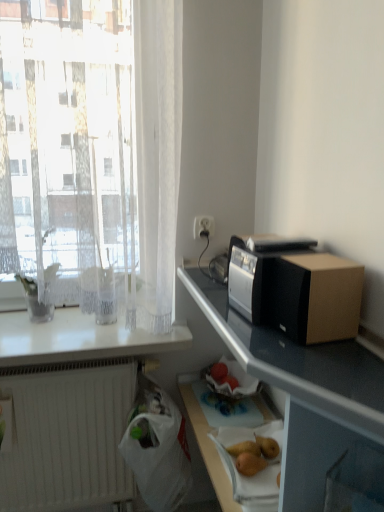
Question: Is black plastic microwave at right bigger than black matte microwave at upper right?

Choices:
 (A) yes
 (B) no

Answer: (B)

Question: Is black plastic microwave at right not inside black matte microwave at upper right?

Choices:
 (A) yes
 (B) no

Answer: (A)

Question: Is black plastic microwave at right turned away from black matte microwave at upper right?

Choices:
 (A) no
 (B) yes

Answer: (A)

Question: Is black plastic microwave at right taller than black matte microwave at upper right?

Choices:
 (A) yes
 (B) no

Answer: (B)

Question: Is black plastic microwave at right at the left side of black matte microwave at upper right?

Choices:
 (A) no
 (B) yes

Answer: (A)

Question: Does black plastic microwave at right have a lesser width compared to black matte microwave at upper right?

Choices:
 (A) yes
 (B) no

Answer: (A)

Question: Is white matte radiator at lower left facing away from white plastic bag at lower center?

Choices:
 (A) no
 (B) yes

Answer: (A)

Question: From the image's perspective, is white matte radiator at lower left above white plastic bag at lower center?

Choices:
 (A) yes
 (B) no

Answer: (B)

Question: Are white matte radiator at lower left and white plastic bag at lower center far apart?

Choices:
 (A) no
 (B) yes

Answer: (A)

Question: Is white matte radiator at lower left at the left side of white plastic bag at lower center?

Choices:
 (A) no
 (B) yes

Answer: (B)

Question: Is white matte radiator at lower left aimed at white plastic bag at lower center?

Choices:
 (A) yes
 (B) no

Answer: (A)

Question: From a real-world perspective, is white matte radiator at lower left located higher than white plastic bag at lower center?

Choices:
 (A) no
 (B) yes

Answer: (A)

Question: From the image's perspective, is brown cardboard box at right located above white glossy countertop at upper left?

Choices:
 (A) no
 (B) yes

Answer: (B)